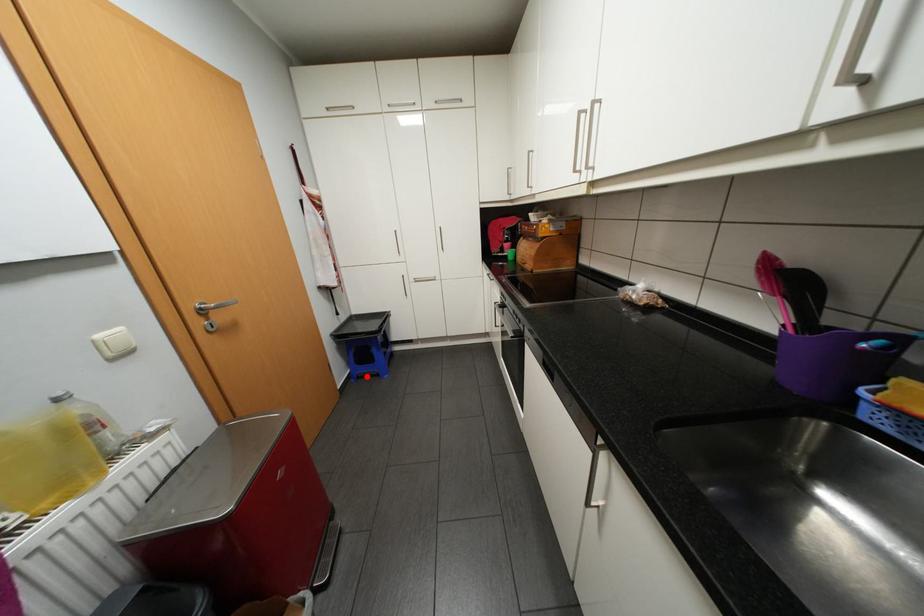
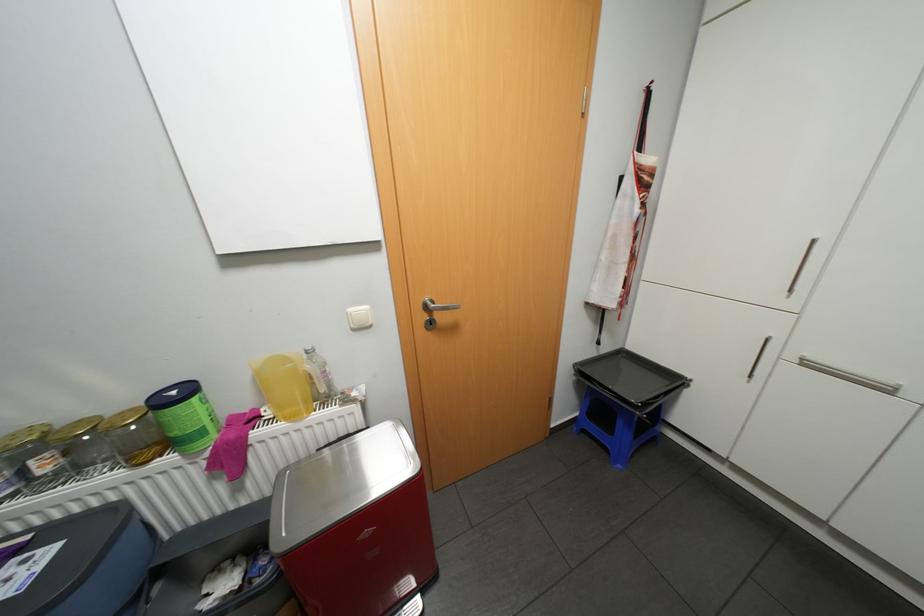
Find the pixel in the second image that matches the highlighted location in the first image.

(591, 431)